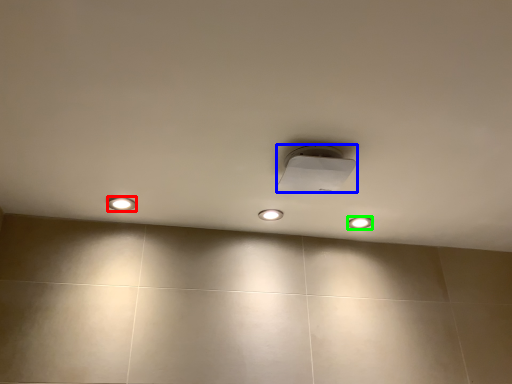
Question: Considering the real-world distances, which object is closest to dot (highlighted by a red box)? lamp (highlighted by a blue box) or dot (highlighted by a green box).

Choices:
 (A) lamp
 (B) dot

Answer: (A)